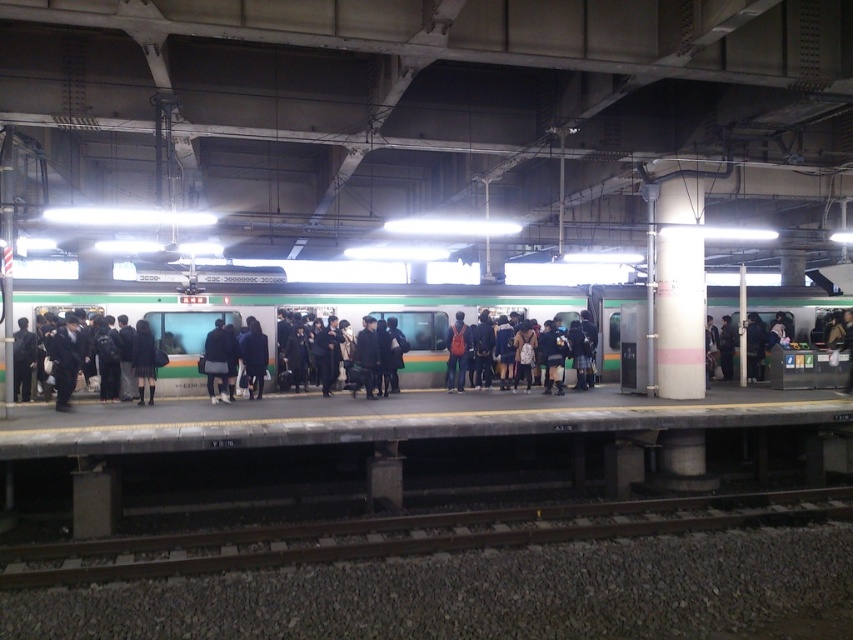
Consider the image. Does matte black skirt at center have a lesser width compared to orange backpack at center?

No.

Between matte black skirt at center and orange backpack at center, which one has less height?

Standing shorter between the two is matte black skirt at center.

Between point (154, 396) and point (465, 362), which one is positioned in front?

Positioned in front is point (154, 396).

The height and width of the screenshot is (640, 853). I want to click on matte black skirt at center, so click(143, 360).

Which of these two, smooth metal train track at lower center or matte black skirt at center, stands shorter?

smooth metal train track at lower center

Which is more to the right, smooth metal train track at lower center or matte black skirt at center?

Positioned to the right is smooth metal train track at lower center.

Does point (740, 502) come farther from viewer compared to point (154, 349)?

No, (740, 502) is in front of (154, 349).

You are a GUI agent. You are given a task and a screenshot of the screen. Output one action in this format:
    pyautogui.click(x=<x>, y=<y>)
    Task: Click on the smooth metal train track at lower center
    This screenshot has height=640, width=853.
    Given the screenshot: What is the action you would take?
    pyautogui.click(x=405, y=536)

How distant is dark gray fabric jacket at center from matte black skirt at center?

dark gray fabric jacket at center and matte black skirt at center are 3.66 feet apart.

Does dark gray fabric jacket at center appear over matte black skirt at center?

Correct, dark gray fabric jacket at center is located above matte black skirt at center.

Which is behind, point (212, 384) or point (148, 333)?

The point (212, 384) is more distant.

Where is `dark gray fabric jacket at center`? dark gray fabric jacket at center is located at coordinates (218, 362).